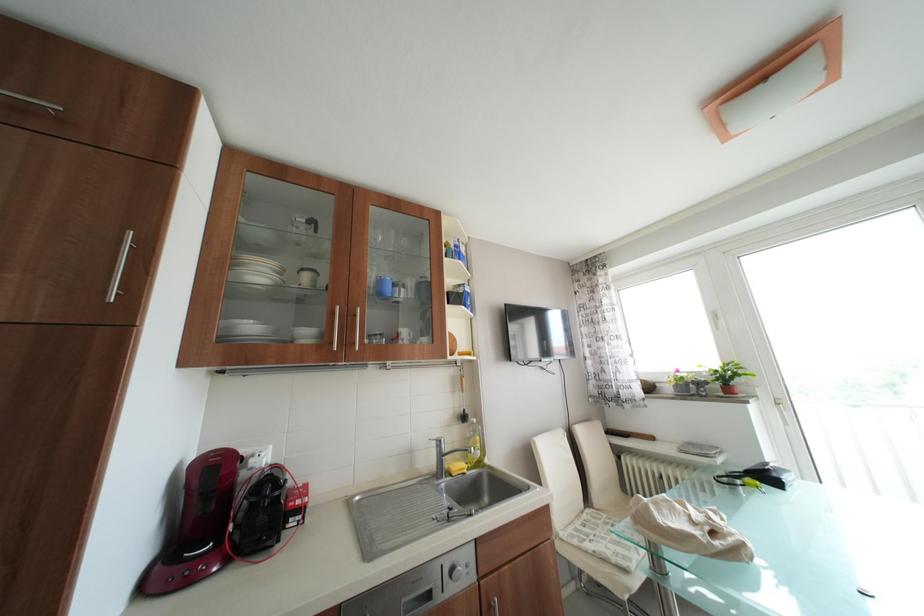
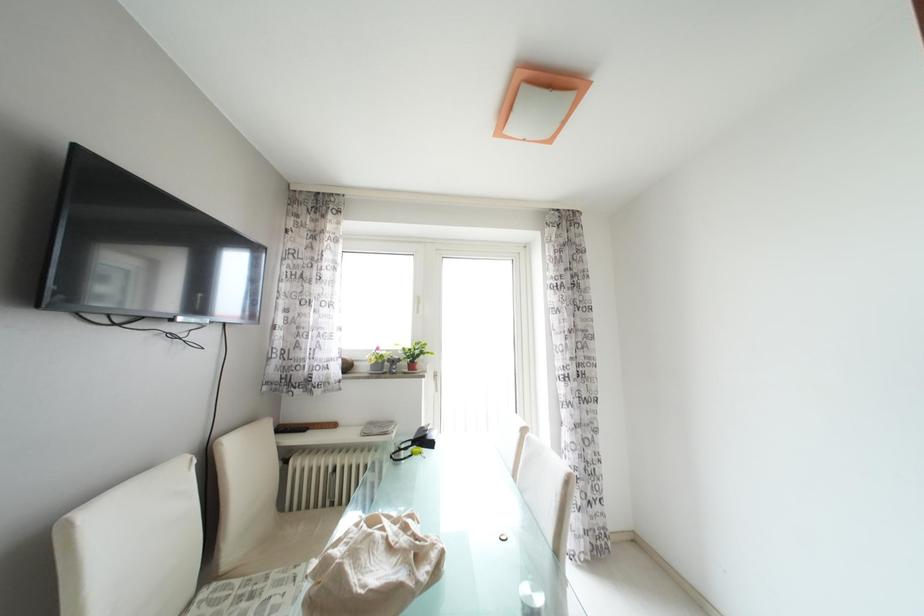
Question: The camera is either moving clockwise (left) or counter-clockwise (right) around the object. The first image is from the beginning of the video and the second image is from the end. Is the camera moving left or right when shooting the video?

Choices:
 (A) Left
 (B) Right

Answer: (A)